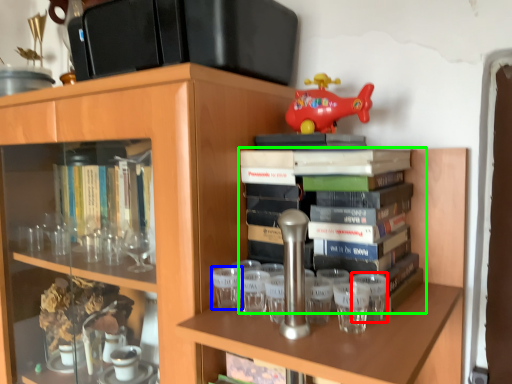
Question: Which is farther away from shot glass (highlighted by a red box)? shot glass (highlighted by a blue box) or book (highlighted by a green box)?

Choices:
 (A) shot glass
 (B) book

Answer: (A)